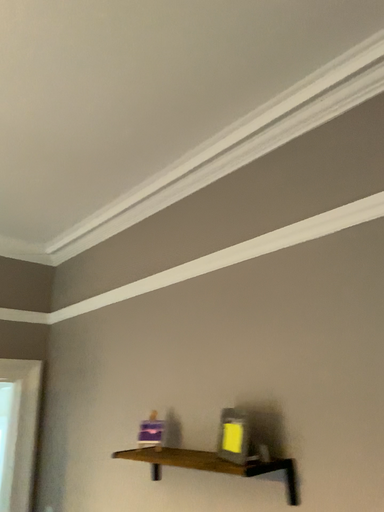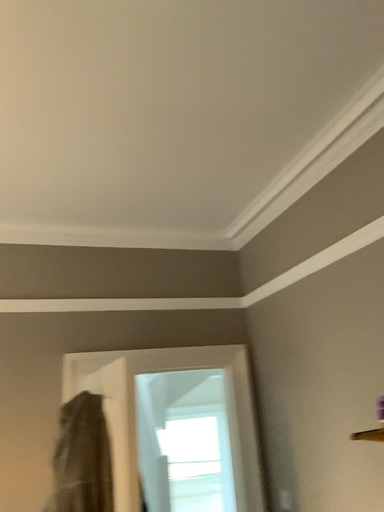
Question: How did the camera likely rotate when shooting the video?

Choices:
 (A) rotated right
 (B) rotated left

Answer: (B)